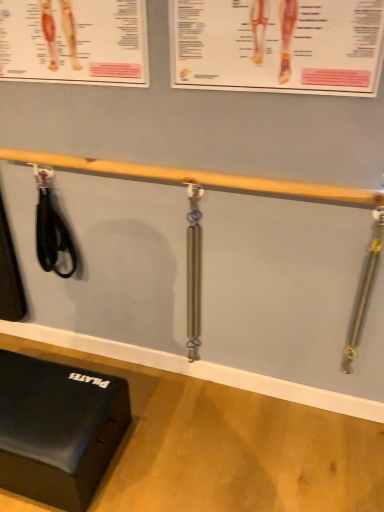
Question: Is black rubber strap at left, marked as the 1th tool in a left-to-right arrangement, to the left of wooden beam at upper center from the viewer's perspective?

Choices:
 (A) no
 (B) yes

Answer: (B)

Question: Is wooden beam at upper center located within black rubber strap at left, marked as the 1th tool in a left-to-right arrangement?

Choices:
 (A) yes
 (B) no

Answer: (B)

Question: Does black rubber strap at left, marked as the 1th tool in a left-to-right arrangement, have a greater height compared to wooden beam at upper center?

Choices:
 (A) no
 (B) yes

Answer: (B)

Question: Is black rubber strap at left, which is the 3th tool from right to left, further to the viewer compared to wooden beam at upper center?

Choices:
 (A) no
 (B) yes

Answer: (B)

Question: From a real-world perspective, is black rubber strap at left, marked as the 1th tool in a left-to-right arrangement, beneath wooden beam at upper center?

Choices:
 (A) yes
 (B) no

Answer: (A)

Question: From a real-world perspective, is silver metallic resistance band at right, the first tool positioned from the right, above or below silver metallic resistance band at center, which is the 2th tool in left-to-right order?

Choices:
 (A) above
 (B) below

Answer: (A)

Question: Considering their positions, is silver metallic resistance band at right, the first tool positioned from the right, located in front of or behind silver metallic resistance band at center, which is the 2th tool in left-to-right order?

Choices:
 (A) behind
 (B) front

Answer: (B)

Question: Considering the positions of silver metallic resistance band at right, the third tool positioned from the left, and silver metallic resistance band at center, which is the 2th tool in left-to-right order, in the image, is silver metallic resistance band at right, the third tool positioned from the left, bigger or smaller than silver metallic resistance band at center, which is the 2th tool in left-to-right order,?

Choices:
 (A) small
 (B) big

Answer: (A)

Question: From the image's perspective, is silver metallic resistance band at right, the first tool positioned from the right, positioned above or below silver metallic resistance band at center, the 2th tool positioned from the right?

Choices:
 (A) above
 (B) below

Answer: (B)

Question: From their relative heights in the image, would you say black rubber exercise mat at lower left is taller or shorter than wooden beam at upper center?

Choices:
 (A) short
 (B) tall

Answer: (B)

Question: Which is correct: black rubber exercise mat at lower left is inside wooden beam at upper center, or outside of it?

Choices:
 (A) inside
 (B) outside

Answer: (B)

Question: Is black rubber exercise mat at lower left in front of or behind wooden beam at upper center in the image?

Choices:
 (A) front
 (B) behind

Answer: (B)

Question: From a real-world perspective, is black rubber exercise mat at lower left above or below wooden beam at upper center?

Choices:
 (A) below
 (B) above

Answer: (A)

Question: Is point (192, 264) closer or farther from the camera than point (41, 231)?

Choices:
 (A) farther
 (B) closer

Answer: (B)

Question: In the image, is silver metallic resistance band at center, the 2th tool positioned from the right, positioned in front of or behind black rubber strap at left, which is the 3th tool from right to left?

Choices:
 (A) behind
 (B) front

Answer: (B)